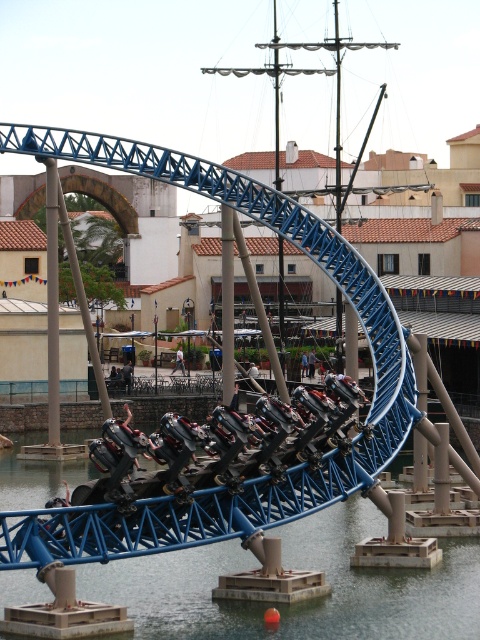
The height and width of the screenshot is (640, 480). What do you see at coordinates (297, 566) in the screenshot?
I see `blue metallic waterway at center` at bounding box center [297, 566].

Looking at this image, is blue metallic waterway at center bigger than blue jeans at center?

Yes.

Where is `blue metallic waterway at center`? blue metallic waterway at center is located at coordinates (297, 566).

This screenshot has width=480, height=640. Identify the location of blue metallic waterway at center. click(297, 566).

Between dark gray fabric jacket at center and light brown wooden chair at center, which one is positioned higher?

light brown wooden chair at center

Between point (127, 387) and point (312, 372), which one is positioned behind?

Point (312, 372)

Is point (127, 380) less distant than point (314, 358)?

Yes, it is in front of point (314, 358).

I want to click on dark gray fabric jacket at center, so click(x=127, y=376).

Between light blue jeans at center and light brown wooden chair at center, which one has more height?

light blue jeans at center is taller.

Can you confirm if light blue jeans at center is bigger than light brown wooden chair at center?

Yes.

Is point (178, 362) positioned before point (310, 378)?

No, (178, 362) is further to viewer.

Find the location of `light blue jeans at center`. light blue jeans at center is located at coordinates (179, 360).